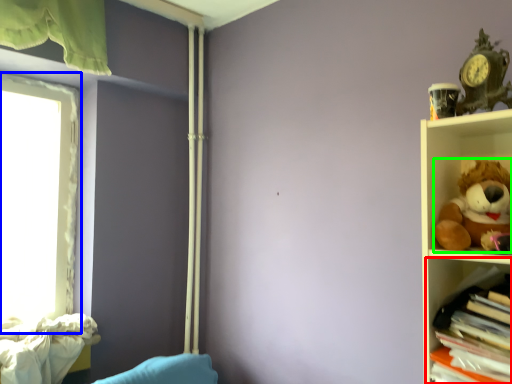
Question: Which object is the closest to the shelf (highlighted by a red box)? Choose among these: window (highlighted by a blue box) or toy (highlighted by a green box).

Choices:
 (A) window
 (B) toy

Answer: (B)